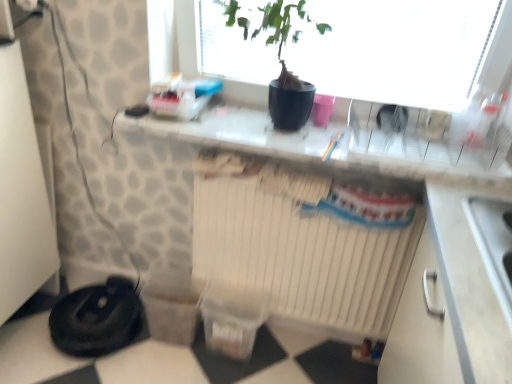
Question: From a real-world perspective, is white glossy countertop at center positioned over white matte radiator at center based on gravity?

Choices:
 (A) yes
 (B) no

Answer: (A)

Question: Does white glossy countertop at center have a greater height compared to white matte radiator at center?

Choices:
 (A) no
 (B) yes

Answer: (A)

Question: Is white glossy countertop at center shorter than white matte radiator at center?

Choices:
 (A) no
 (B) yes

Answer: (B)

Question: Is white glossy countertop at center located outside white matte radiator at center?

Choices:
 (A) yes
 (B) no

Answer: (A)

Question: Is white matte radiator at center located within white glossy countertop at center?

Choices:
 (A) yes
 (B) no

Answer: (B)

Question: Can you confirm if white glossy countertop at center is positioned to the left of white matte radiator at center?

Choices:
 (A) yes
 (B) no

Answer: (B)

Question: Considering the relative positions of black rubber vacuum cleaner at lower left and black matte pot at upper center in the image provided, is black rubber vacuum cleaner at lower left to the left of black matte pot at upper center from the viewer's perspective?

Choices:
 (A) yes
 (B) no

Answer: (A)

Question: Is black rubber vacuum cleaner at lower left wider than black matte pot at upper center?

Choices:
 (A) yes
 (B) no

Answer: (A)

Question: Can you confirm if black rubber vacuum cleaner at lower left is smaller than black matte pot at upper center?

Choices:
 (A) no
 (B) yes

Answer: (B)

Question: From a real-world perspective, is black rubber vacuum cleaner at lower left over black matte pot at upper center?

Choices:
 (A) yes
 (B) no

Answer: (B)

Question: Is black rubber vacuum cleaner at lower left not close to black matte pot at upper center?

Choices:
 (A) yes
 (B) no

Answer: (A)

Question: Considering the relative positions of black rubber vacuum cleaner at lower left and black matte pot at upper center in the image provided, is black rubber vacuum cleaner at lower left behind black matte pot at upper center?

Choices:
 (A) yes
 (B) no

Answer: (A)

Question: Is white glossy countertop at center taller than black rubber vacuum cleaner at lower left?

Choices:
 (A) yes
 (B) no

Answer: (B)